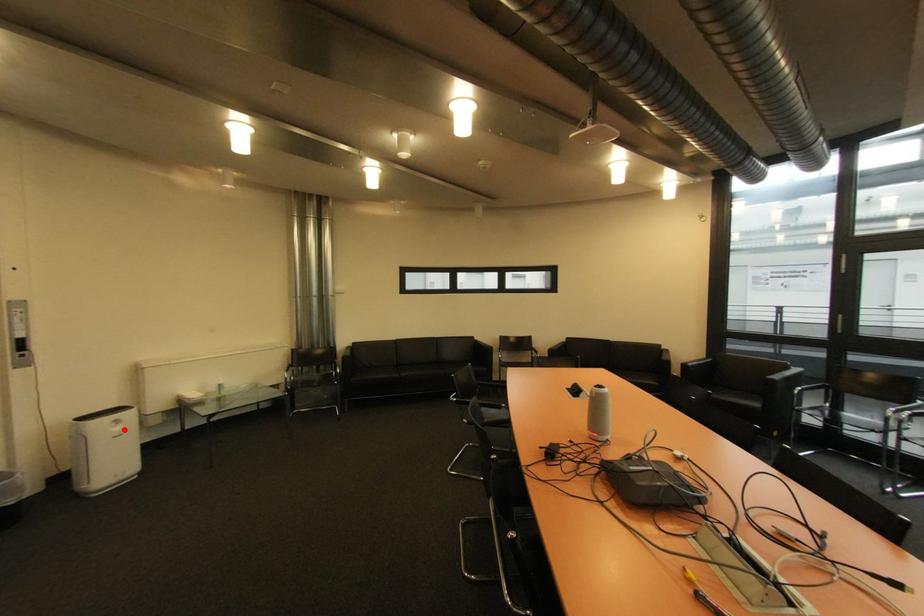
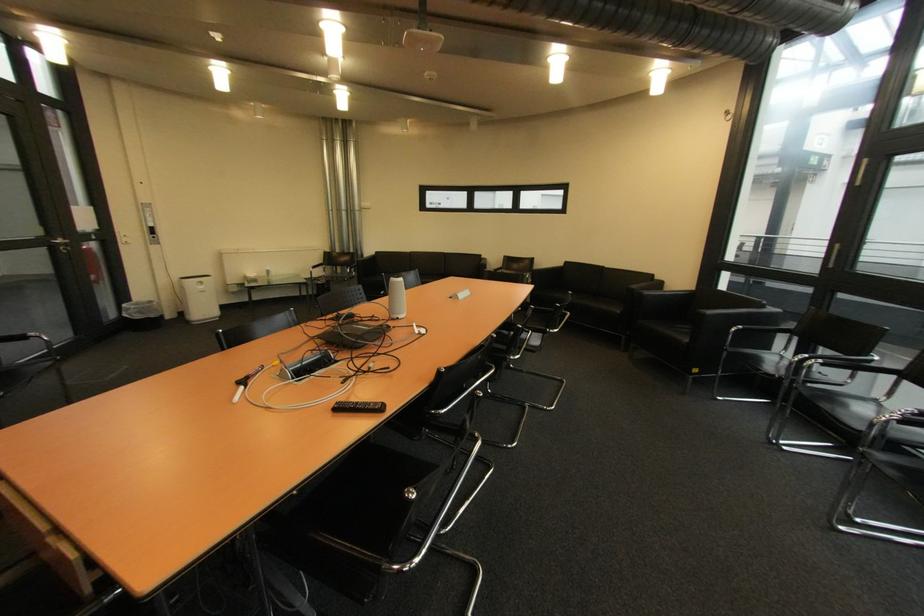
Question: I am providing you with two images of the same scene from different viewpoints. Given a red point in image1, look at the same physical point in image2. Is it:

Choices:
 (A) Closer to the viewpoint
 (B) Farther from the viewpoint

Answer: (A)